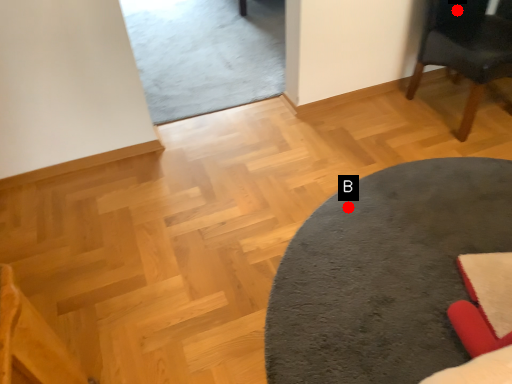
Question: Two points are circled on the image, labeled by A and B beside each circle. Which point is closer to the camera?

Choices:
 (A) A is closer
 (B) B is closer

Answer: (B)